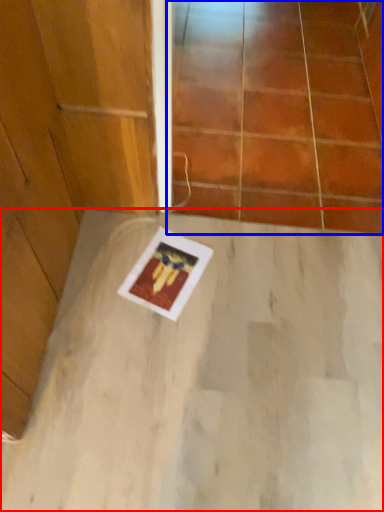
Question: Which of the following is the closest to the observer, concrete (highlighted by a red box) or glass door (highlighted by a blue box)?

Choices:
 (A) concrete
 (B) glass door

Answer: (A)